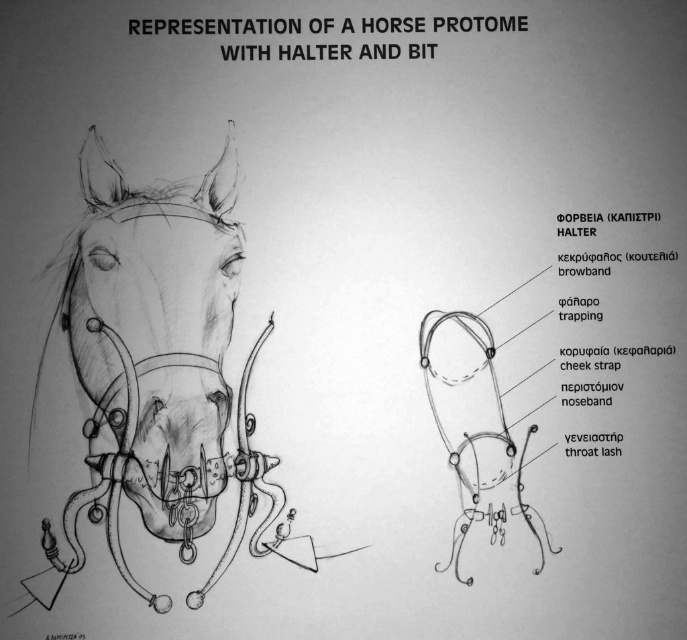
Question: Which of the following is the closest to the observer?

Choices:
 (A) matte black horse head at center
 (B) matte black muzzle at center

Answer: (A)

Question: Which point is farther from the camera taking this photo?

Choices:
 (A) (223, 432)
 (B) (172, 484)

Answer: (A)

Question: Does matte black horse head at center have a greater width compared to matte black muzzle at center?

Choices:
 (A) no
 (B) yes

Answer: (B)

Question: Can you confirm if matte black horse head at center is bigger than matte black muzzle at center?

Choices:
 (A) no
 (B) yes

Answer: (B)

Question: Does matte black horse head at center have a smaller size compared to matte black muzzle at center?

Choices:
 (A) no
 (B) yes

Answer: (A)